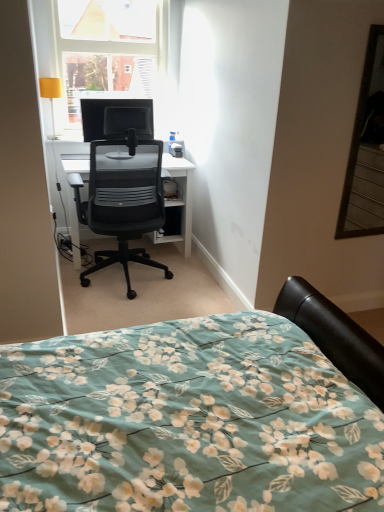
In order to face matte black monitor at upper center, should I rotate leftwards or rightwards?

To align with it, rotate left about 9.328°.

Looking at this image, what is the approximate height of floral fabric bed at lower left?

floral fabric bed at lower left is 1.10 meters in height.

You are a GUI agent. You are given a task and a screenshot of the screen. Output one action in this format:
    pyautogui.click(x=<x>, y=<y>)
    Task: Click on the transparent glass window at upper left
    
    Given the screenshot: What is the action you would take?
    pyautogui.click(x=109, y=50)

Describe the element at coordinates (51, 97) in the screenshot. I see `yellow fabric lampshade at upper left` at that location.

Find the location of `yellow fabric lampshade at upper left`. yellow fabric lampshade at upper left is located at coordinates (51, 97).

This screenshot has height=512, width=384. Identify the location of matte black monitor at upper center. 116,118.

In the scene shown: How much distance is there between floral fabric bed at lower left and transparent glass window at upper left?

A distance of 2.67 meters exists between floral fabric bed at lower left and transparent glass window at upper left.

Is point (7, 396) positioned behind point (67, 10)?

No.

How different are the orientations of floral fabric bed at lower left and transparent glass window at upper left in degrees?

90.5 degrees separate the facing orientations of floral fabric bed at lower left and transparent glass window at upper left.

Locate an element on the screen. Image resolution: width=384 pixels, height=512 pixels. window that is on the left side of floral fabric bed at lower left is located at coordinates (109, 50).

Is yellow fabric lampshade at upper left positioned with its back to transparent glass window at upper left?

No, transparent glass window at upper left is not at the back of yellow fabric lampshade at upper left.

Is transparent glass window at upper left surrounded by yellow fabric lampshade at upper left?

Actually, transparent glass window at upper left is outside yellow fabric lampshade at upper left.

From the image's perspective, which is above, yellow fabric lampshade at upper left or transparent glass window at upper left?

transparent glass window at upper left.

Does point (47, 90) appear closer or farther from the camera than point (116, 33)?

Point (47, 90) appears to be closer to the viewer than point (116, 33).

From the image's perspective, which is below, transparent glass window at upper left or floral fabric bed at lower left?

floral fabric bed at lower left is shown below in the image.

Is transparent glass window at upper left oriented towards floral fabric bed at lower left?

Yes, transparent glass window at upper left is aimed at floral fabric bed at lower left.

Can you confirm if transparent glass window at upper left is thinner than floral fabric bed at lower left?

Correct, the width of transparent glass window at upper left is less than that of floral fabric bed at lower left.

Image resolution: width=384 pixels, height=512 pixels. Identify the location of window behind the floral fabric bed at lower left. (109, 50).

Choose the correct answer: Is floral fabric bed at lower left inside matte black monitor at upper center or outside it?

floral fabric bed at lower left exists outside the volume of matte black monitor at upper center.

Considering the relative sizes of floral fabric bed at lower left and matte black monitor at upper center in the image provided, is floral fabric bed at lower left smaller than matte black monitor at upper center?

No.

From a real-world perspective, is floral fabric bed at lower left located beneath matte black monitor at upper center?

Indeed, from a real-world perspective, floral fabric bed at lower left is positioned beneath matte black monitor at upper center.

Considering the positions of objects floral fabric bed at lower left and matte black monitor at upper center in the image provided, who is more to the left, floral fabric bed at lower left or matte black monitor at upper center?

Positioned to the left is matte black monitor at upper center.

Are yellow fabric lampshade at upper left and black mesh chair at center far apart?

No, yellow fabric lampshade at upper left is in close proximity to black mesh chair at center.

From the image's perspective, relative to black mesh chair at center, is yellow fabric lampshade at upper left above or below?

Based on their image positions, yellow fabric lampshade at upper left is located above black mesh chair at center.

Which of these two, yellow fabric lampshade at upper left or black mesh chair at center, stands taller?

black mesh chair at center.

From a real-world perspective, who is located higher, yellow fabric lampshade at upper left or black mesh chair at center?

In real-world perspective, yellow fabric lampshade at upper left is above.

Is matte black monitor at upper center facing away from yellow fabric lampshade at upper left?

matte black monitor at upper center is not turned away from yellow fabric lampshade at upper left.

Is yellow fabric lampshade at upper left completely or partially inside matte black monitor at upper center?

That's incorrect, yellow fabric lampshade at upper left is not inside matte black monitor at upper center.

From a real-world perspective, between matte black monitor at upper center and yellow fabric lampshade at upper left, who is vertically higher?

In real-world perspective, yellow fabric lampshade at upper left is above.

How different are the orientations of matte black monitor at upper center and yellow fabric lampshade at upper left in degrees?

The angular difference between matte black monitor at upper center and yellow fabric lampshade at upper left is 0.239 degrees.

Based on their sizes in the image, would you say matte black monitor at upper center is bigger or smaller than transparent glass window at upper left?

matte black monitor at upper center is smaller than transparent glass window at upper left.

Is matte black monitor at upper center far from transparent glass window at upper left?

They are positioned close to each other.

Which object is positioned more to the left, matte black monitor at upper center or transparent glass window at upper left?

transparent glass window at upper left.

Does point (103, 136) appear closer or farther from the camera than point (89, 25)?

Point (103, 136) is closer to the camera than point (89, 25).

Identify the location of window above the floral fabric bed at lower left (from a real-world perspective). (109, 50).

Image resolution: width=384 pixels, height=512 pixels. I want to click on window on the right of yellow fabric lampshade at upper left, so click(x=109, y=50).

When comparing their distances from black mesh chair at center, does yellow fabric lampshade at upper left or matte black monitor at upper center seem further?

→ yellow fabric lampshade at upper left is positioned further to the anchor black mesh chair at center.

When comparing their distances from yellow fabric lampshade at upper left, does floral fabric bed at lower left or black mesh chair at center seem closer?

Among the two, black mesh chair at center is located nearer to yellow fabric lampshade at upper left.

From the image, which object appears to be farther from black mesh chair at center, floral fabric bed at lower left or yellow fabric lampshade at upper left?

floral fabric bed at lower left lies further to black mesh chair at center than the other object.

Considering their positions, is transparent glass window at upper left positioned further to floral fabric bed at lower left than matte black monitor at upper center?

Among the two, transparent glass window at upper left is located further to floral fabric bed at lower left.

Estimate the real-world distances between objects in this image. Which object is closer to transparent glass window at upper left, yellow fabric lampshade at upper left or floral fabric bed at lower left?

The object closer to transparent glass window at upper left is yellow fabric lampshade at upper left.

Estimate the real-world distances between objects in this image. Which object is further from yellow fabric lampshade at upper left, transparent glass window at upper left or matte black monitor at upper center?

Among the two, transparent glass window at upper left is located further to yellow fabric lampshade at upper left.

From the image, which object appears to be nearer to floral fabric bed at lower left, matte black monitor at upper center or transparent glass window at upper left?

Among the two, matte black monitor at upper center is located nearer to floral fabric bed at lower left.

When comparing their distances from transparent glass window at upper left, does black mesh chair at center or yellow fabric lampshade at upper left seem further?

Among the two, yellow fabric lampshade at upper left is located further to transparent glass window at upper left.

The width and height of the screenshot is (384, 512). Identify the location of television between floral fabric bed at lower left and yellow fabric lampshade at upper left along the z-axis. (116, 118).

Locate an element on the screen. The height and width of the screenshot is (512, 384). television located between black mesh chair at center and yellow fabric lampshade at upper left in the depth direction is located at coordinates (116, 118).

Find the location of `window between yellow fabric lampshade at upper left and matte black monitor at upper center in the horizontal direction`. window between yellow fabric lampshade at upper left and matte black monitor at upper center in the horizontal direction is located at coordinates (109, 50).

Find the location of a particular element. The image size is (384, 512). chair between floral fabric bed at lower left and transparent glass window at upper left along the z-axis is located at coordinates (123, 200).